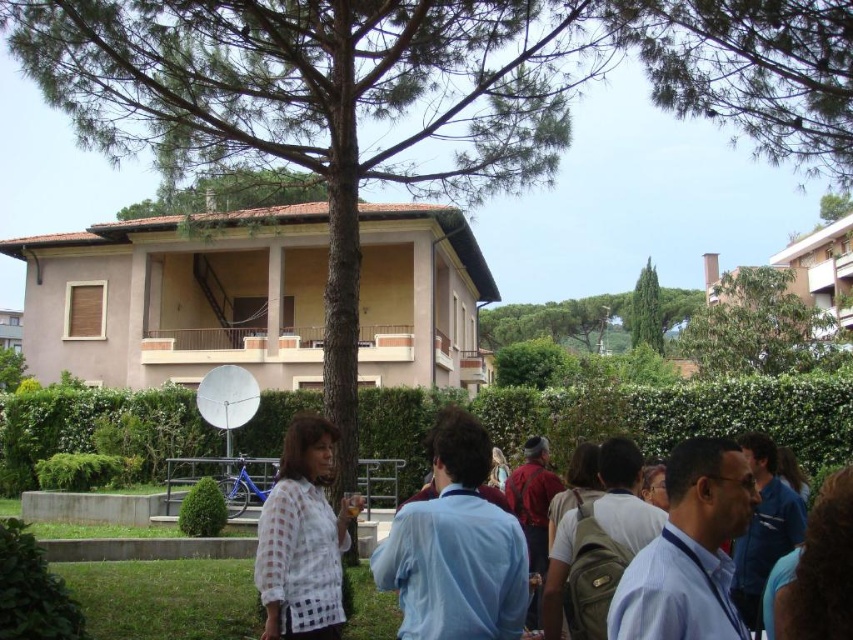
You are a photographer trying to capture a photo of the residential building with both the green leafy tree at upper right and the green textured tree at center in the frame. Based on their positions, which tree should you position closer to the building to ensure both are visible in the background?

The green leafy tree at upper right is below the green textured tree at center, so you should position the green leafy tree at upper right closer to the building to ensure both are visible in the background.

You are a photographer taking a picture of the scene. You want to ensure the white sheer blouse at center and the green leafy tree at upper right are both visible. Which object should you focus on first to frame them properly?

You should focus on the green leafy tree at upper right first because the white sheer blouse at center is below it, so adjusting the frame to include the tree will naturally include the blouse as well.

You are a photographer standing in the garden area. You want to take a photo of the light blue shirt at center and the green leafy tree at upper center. Which object should you focus on first if you want to capture both in the frame without moving the camera?

The light blue shirt at center should be focused on first because it is closer to the photographer than the green leafy tree at upper center, which is further away. This allows both to be in focus without moving the camera.